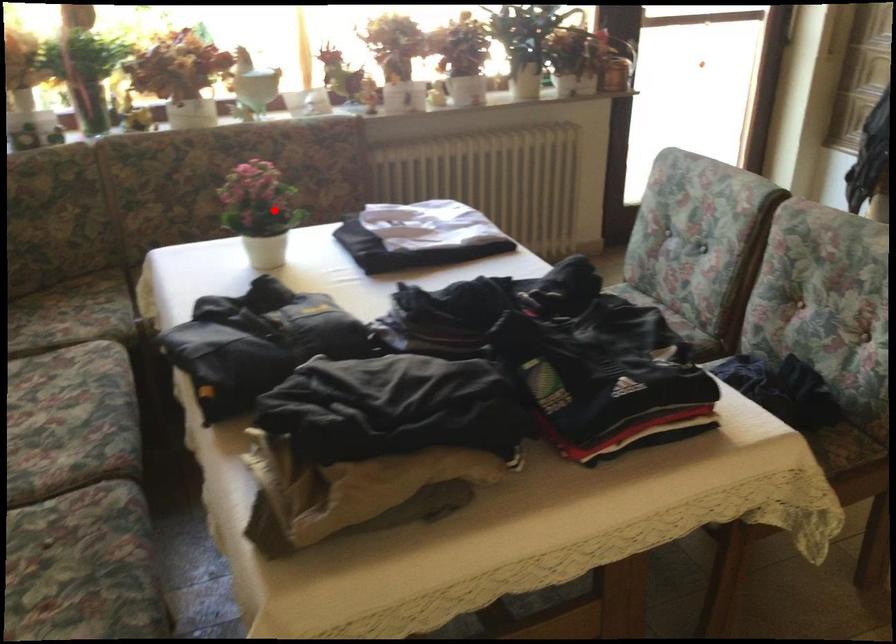
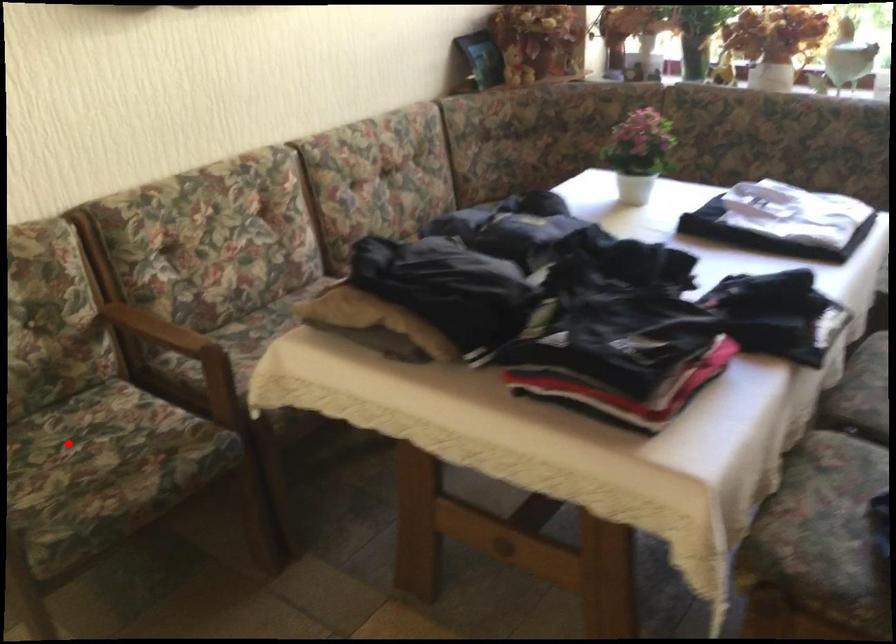
I am providing you with two images of the same scene from different viewpoints. A red point is marked on the first image and another point is marked on the second image. Does the point marked in image1 correspond to the same location as the one in image2?

No